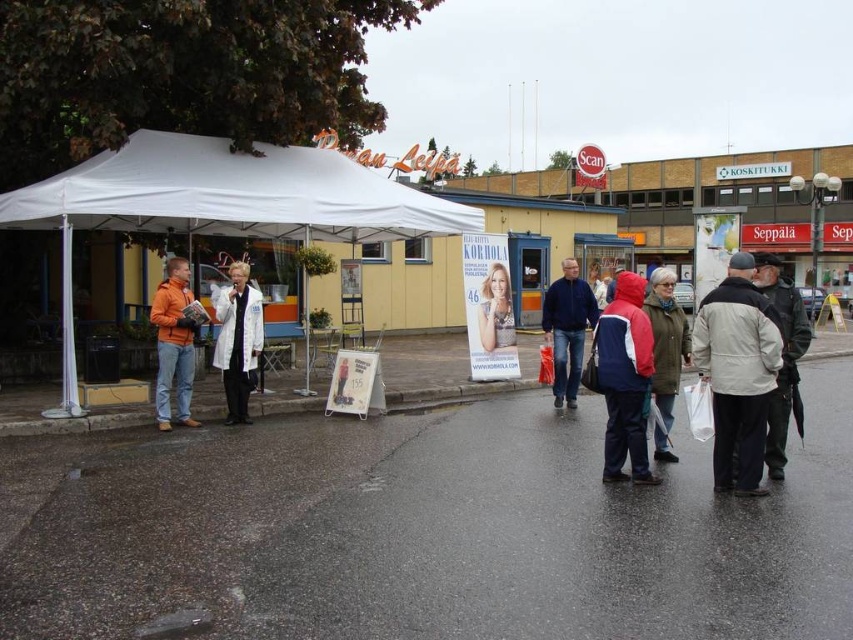
You are a delivery person with a cart that is 12 feet wide. You need to navigate through the space between the dark gray jacket at right and the green wool coat at lower right. Can your cart fit through the gap between them?

The distance between the dark gray jacket at right and the green wool coat at lower right is 11.95 feet, which is slightly less than the cart width of 12 feet. Therefore, the cart cannot fit through the gap between them.

You are a delivery person trying to navigate to the red and blue jacket at center and the dark gray jacket at right. Based on the scene, which jacket is positioned lower in the image?

The red and blue jacket at center is below dark gray jacket at right, so the red and blue jacket at center is positioned lower in the image.